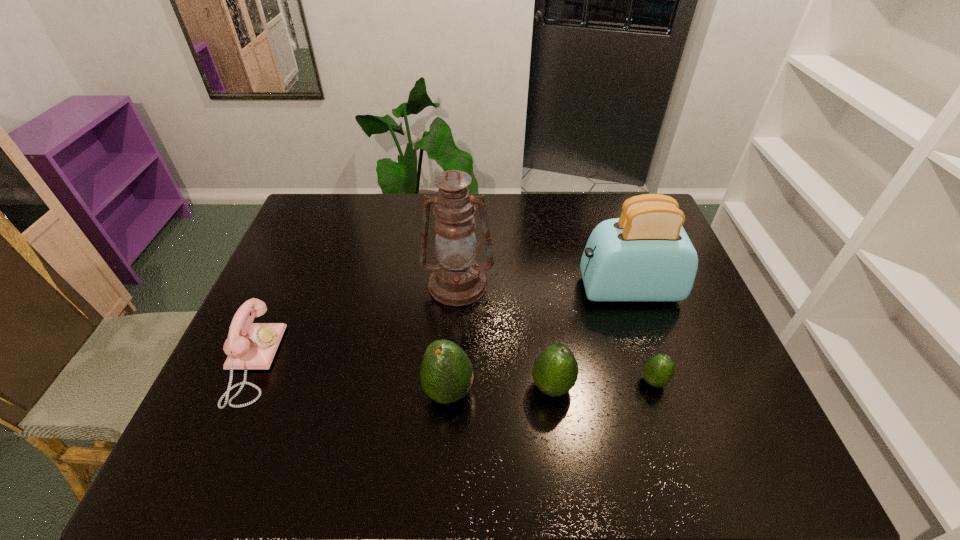
Where is `vacant position at the far edge of the desktop`? This screenshot has height=540, width=960. vacant position at the far edge of the desktop is located at coordinates (491, 218).

Image resolution: width=960 pixels, height=540 pixels. In order to click on vacant space at the near edge in this screenshot , I will do `click(621, 407)`.

Locate an element on the screen. This screenshot has height=540, width=960. vacant space at the left edge of the desktop is located at coordinates (272, 276).

In the image, there is a desktop. Where is `free space at the right edge`? free space at the right edge is located at coordinates [726, 358].

Where is `free region at the far left corner of the desktop`? Image resolution: width=960 pixels, height=540 pixels. free region at the far left corner of the desktop is located at coordinates (321, 220).

Where is `vacant point located between the toaster and the tallest object`? vacant point located between the toaster and the tallest object is located at coordinates (542, 287).

You are a GUI agent. You are given a task and a screenshot of the screen. Output one action in this format:
    pyautogui.click(x=<x>, y=<y>)
    Task: Click on the free space between the leftmost object and the leftmost avocado
    Image resolution: width=960 pixels, height=540 pixels.
    Given the screenshot: What is the action you would take?
    pyautogui.click(x=350, y=377)

At what (x,y) coordinates should I click in order to perform the action: click on free space between the telephone and the tallest object. Please return your answer as a coordinate pair (x, y). Looking at the image, I should click on (354, 324).

This screenshot has width=960, height=540. Find the location of `blank region between the oil lamp and the second tallest object`. blank region between the oil lamp and the second tallest object is located at coordinates (542, 287).

Image resolution: width=960 pixels, height=540 pixels. In order to click on free space between the leftmost object and the tallest object in this screenshot , I will do `click(354, 324)`.